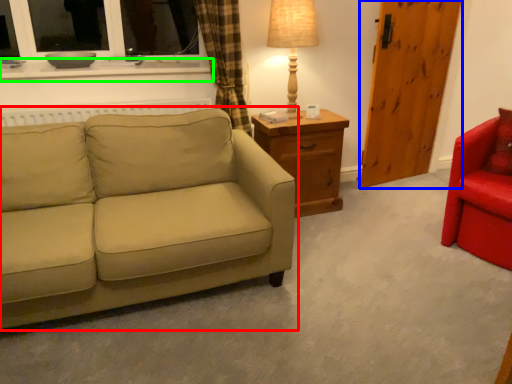
Question: Which is farther away from studio couch (highlighted by a red box)? barn door (highlighted by a blue box) or window sill (highlighted by a green box)?

Choices:
 (A) barn door
 (B) window sill

Answer: (A)